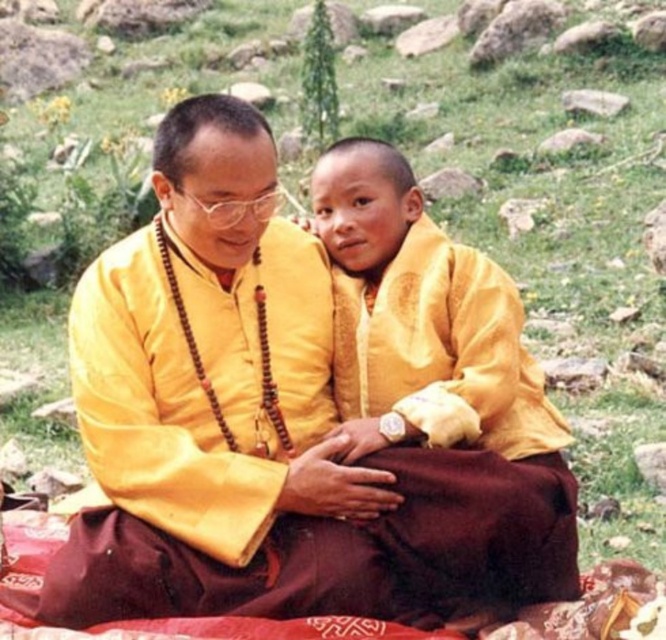
Is yellow silk robe at center to the left of yellow matte/yellow fabric at center from the viewer's perspective?

Indeed, yellow silk robe at center is positioned on the left side of yellow matte/yellow fabric at center.

Between point (73, 340) and point (555, 412), which one is positioned behind?

Positioned behind is point (555, 412).

At what (x,y) coordinates should I click in order to perform the action: click on yellow silk robe at center. Please return your answer as a coordinate pair (x, y). Image resolution: width=666 pixels, height=640 pixels. Looking at the image, I should click on (264, 429).